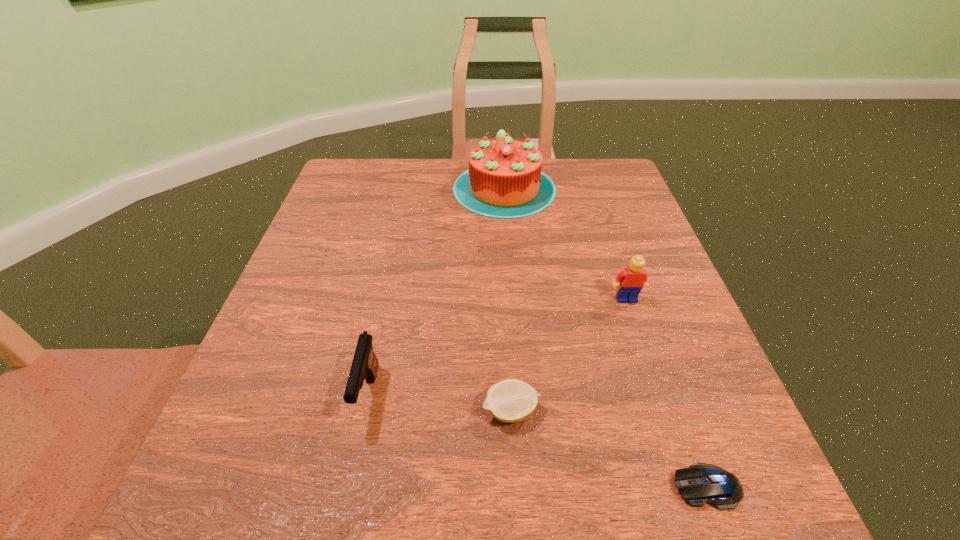
What are the coordinates of `free space located 0.090m on the front of the fourth tallest object` in the screenshot? It's located at (516, 493).

Where is `blank space located on the button side of the nearest object`? This screenshot has width=960, height=540. blank space located on the button side of the nearest object is located at coordinates (557, 487).

Locate an element on the screen. This screenshot has width=960, height=540. free space located on the button side of the nearest object is located at coordinates (527, 487).

At what (x,y) coordinates should I click in order to perform the action: click on vacant space located on the button side of the nearest object. Please return your answer as a coordinate pair (x, y). Looking at the image, I should click on (x=462, y=487).

Where is `object present at the far edge`? The width and height of the screenshot is (960, 540). object present at the far edge is located at coordinates (504, 180).

Image resolution: width=960 pixels, height=540 pixels. I want to click on object positioned at the near edge, so click(x=700, y=483).

Find the location of a particular element. This screenshot has width=960, height=540. Lego that is at the right edge is located at coordinates (632, 279).

The image size is (960, 540). I want to click on computer mouse that is at the right edge, so click(700, 483).

I want to click on object at the near right corner, so click(700, 483).

I want to click on free spot at the far edge of the desktop, so click(404, 188).